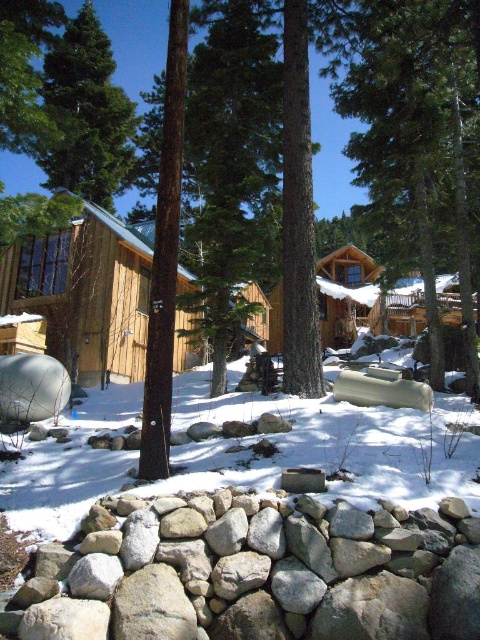
Question: Is gray rock wall at lower center closer to the viewer compared to wooden cabin at center?

Choices:
 (A) no
 (B) yes

Answer: (B)

Question: Does gray rock wall at lower center have a lesser width compared to wooden cabin at center?

Choices:
 (A) yes
 (B) no

Answer: (A)

Question: Which of the following is the farthest from the observer?

Choices:
 (A) gray rock wall at lower center
 (B) brown wood tree at center
 (C) green matte tree at upper left
 (D) wooden cabin at center

Answer: (C)

Question: Is gray rock wall at lower center smaller than brown wood tree at center?

Choices:
 (A) no
 (B) yes

Answer: (B)

Question: Which of the following is the farthest from the observer?

Choices:
 (A) (199, 358)
 (B) (103, 76)
 (C) (417, 250)

Answer: (B)

Question: Which point appears farthest from the camera in this image?

Choices:
 (A) (99, 324)
 (B) (71, 35)
 (C) (408, 128)

Answer: (B)